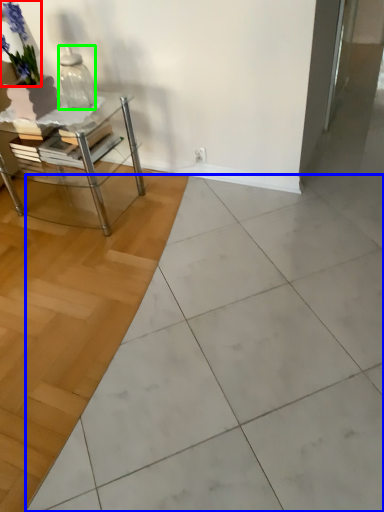
Question: Which object is positioned farthest from flower (highlighted by a red box)? Select from ceramic tile (highlighted by a blue box) and vase (highlighted by a green box).

Choices:
 (A) ceramic tile
 (B) vase

Answer: (A)